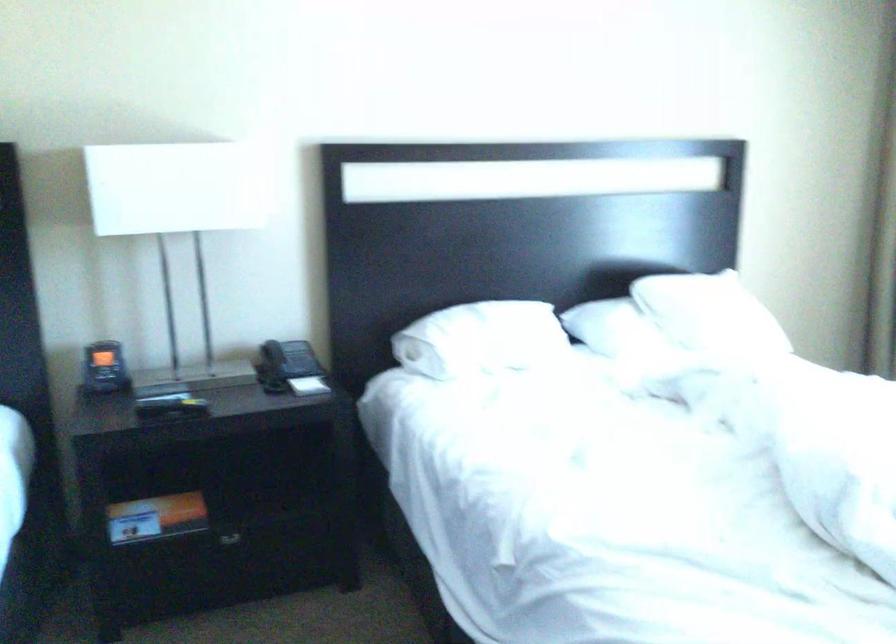
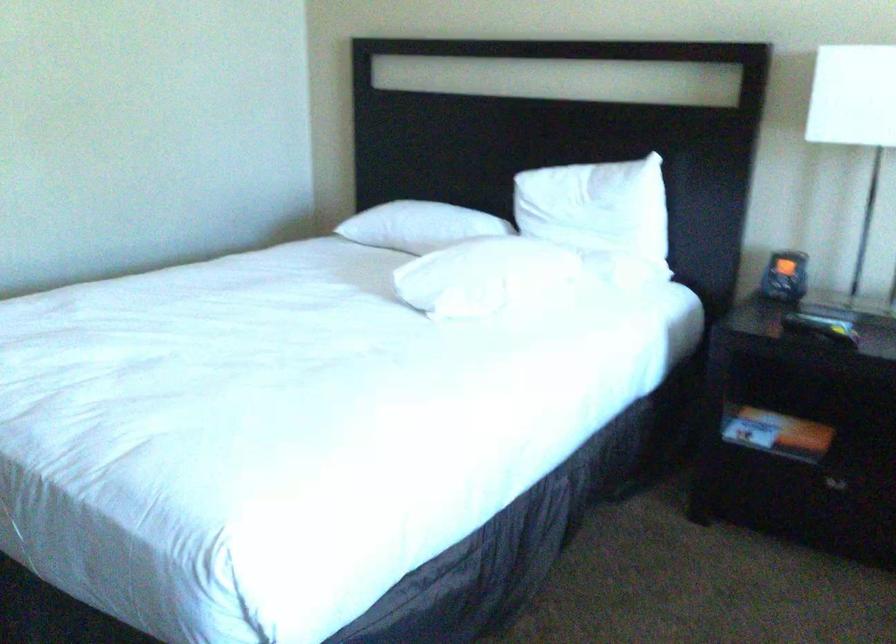
Where in the second image is the point corresponding to (116,374) from the first image?

(785, 276)